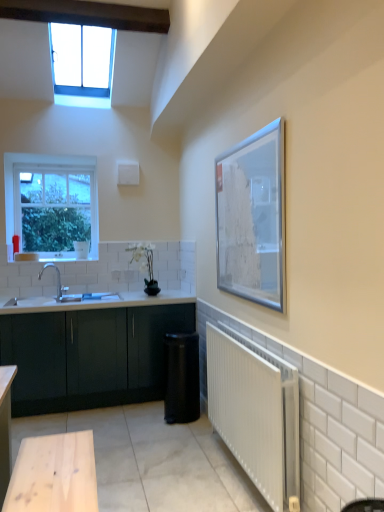
Locate an element on the screen. The width and height of the screenshot is (384, 512). vacant area that is in front of black matte water heater at lower right is located at coordinates (182, 432).